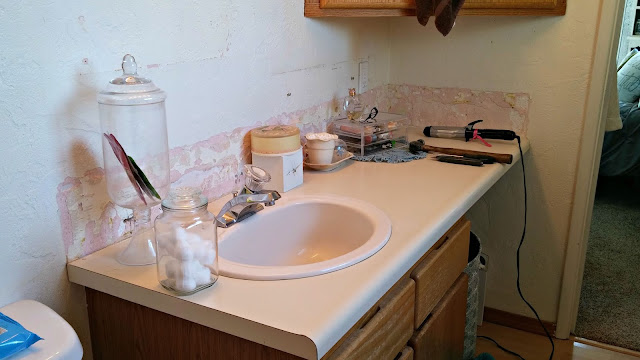
At what (x,y) coordinates should I click in order to perform the action: click on paint. Please return your answer as a coordinate pair (x, y). This screenshot has height=360, width=640. Looking at the image, I should click on (217, 167).